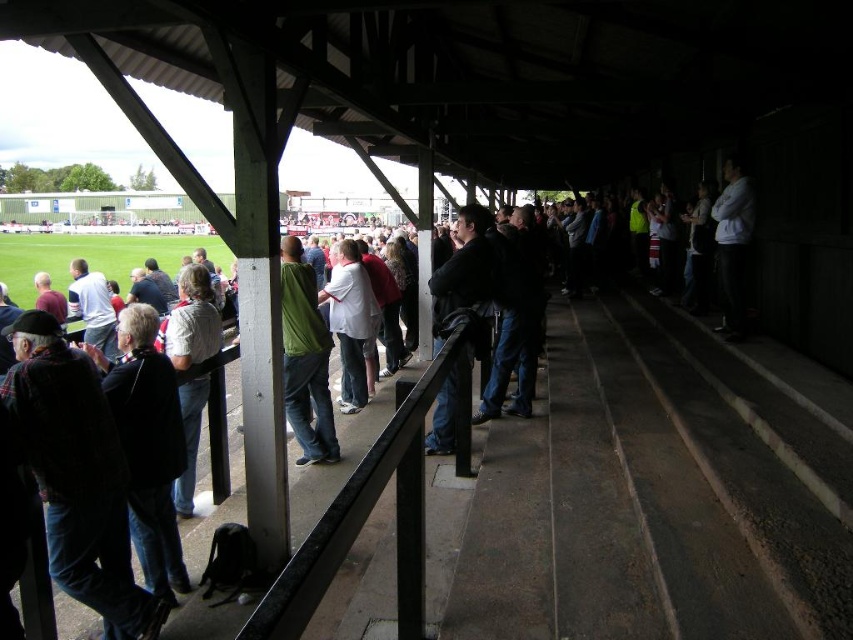
You are a photographer trying to capture a candid shot of both the green matte shirt at center and the white matte jacket at upper right. Which clothing item is located to the left of the other?

The green matte shirt at center is positioned on the left side of white matte jacket at upper right, so the green matte shirt at center is to the left of the white matte jacket at upper right.

You are sitting in the stadium and want to locate the dark plaid sweater at left. According to the coordinates given, where should you look?

The dark plaid sweater at left is located at point (77, 476).

You are standing at the point marked by the coordinates point (77, 476) in the image. What object is located at that position?

The point (77, 476) indicates the location of the dark plaid sweater at left.